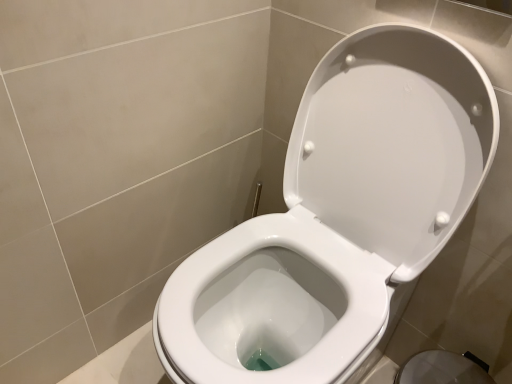
This screenshot has width=512, height=384. Find the location of `white glossy toilet at center`. white glossy toilet at center is located at coordinates (339, 216).

This screenshot has height=384, width=512. Describe the element at coordinates (339, 216) in the screenshot. I see `white glossy toilet at center` at that location.

I want to click on white glossy toilet at center, so click(x=339, y=216).